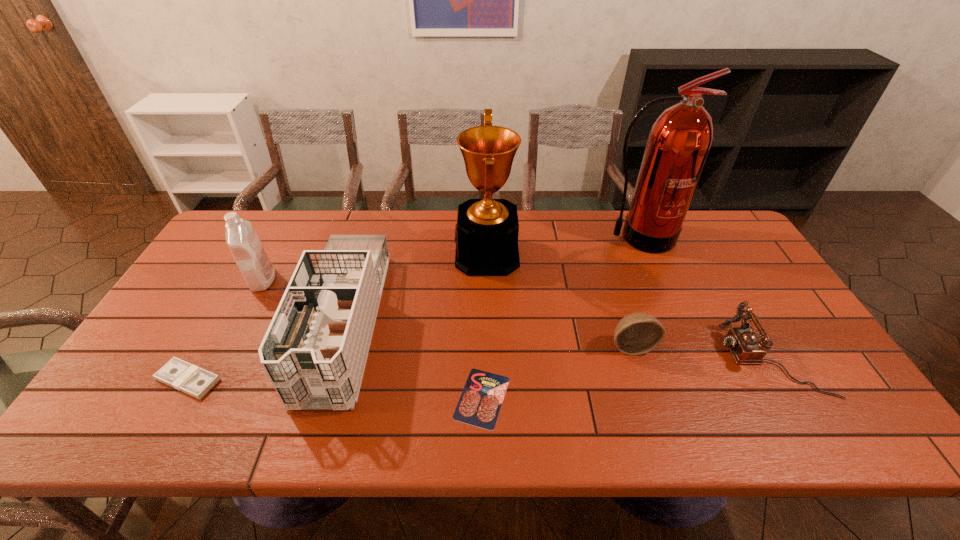
Identify the location of blank area located 0.350m on the front of the seventh shortest object with the label. (x=345, y=255).

This screenshot has width=960, height=540. Identify the location of vacant area located 0.220m on the front of the seventh shortest object with the label. (386, 255).

Find the location of a particular element. The width and height of the screenshot is (960, 540). vacant space located on the front of the seventh shortest object with the label is located at coordinates (358, 255).

Where is `vacant region located on the front of the detergent`? vacant region located on the front of the detergent is located at coordinates (204, 391).

The image size is (960, 540). In order to click on free location located at the entrance of the dollhouse in this screenshot , I will do `click(311, 435)`.

The height and width of the screenshot is (540, 960). Identify the location of vacant space located 0.320m on the back of the bowl. (604, 257).

This screenshot has height=540, width=960. I want to click on vacant space located 0.090m on the dial of the third shortest object, so click(688, 359).

This screenshot has height=540, width=960. I want to click on free location located on the dial of the third shortest object, so click(x=692, y=359).

What are the coordinates of `free space located on the dial of the third shortest object` in the screenshot? It's located at (628, 359).

At what (x,y) coordinates should I click in order to perform the action: click on vacant space located on the right of the second shortest object. Please return your answer as a coordinate pair (x, y). Looking at the image, I should click on (317, 380).